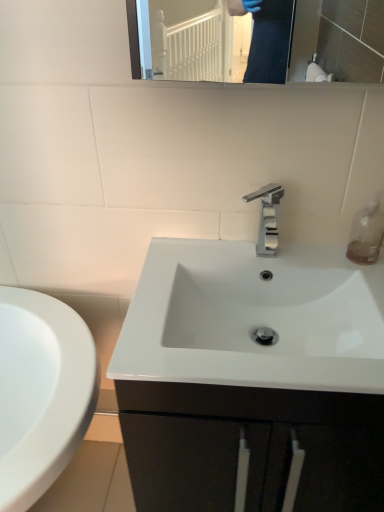
You are a GUI agent. You are given a task and a screenshot of the screen. Output one action in this format:
    pyautogui.click(x=<x>, y=<y>)
    Task: Click on the unoccupied region to the right of polished chrome faucet at center
    This screenshot has height=512, width=384.
    Given the screenshot: What is the action you would take?
    pyautogui.click(x=322, y=260)